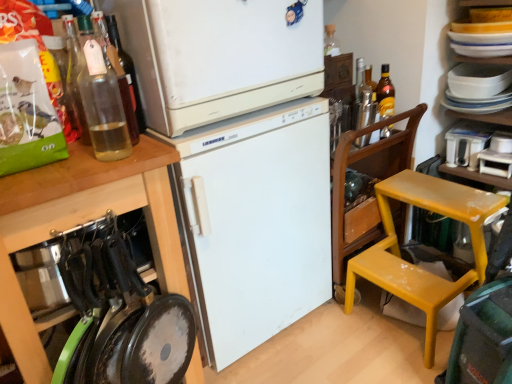
Question: Do you think metallic silver shaker at upper right, the second bottle viewed from the right, is within white glossy bowls at upper right, the 2th appliance ordered from the bottom, or outside of it?

Choices:
 (A) inside
 (B) outside

Answer: (B)

Question: From the image's perspective, is metallic silver shaker at upper right, the 3th bottle viewed from the front, located above or below white glossy bowls at upper right, arranged as the first appliance when viewed from the top?

Choices:
 (A) above
 (B) below

Answer: (B)

Question: Based on their relative distances, which object is farther from the white plastic container at upper right, the first appliance from the bottom?

Choices:
 (A) metallic silver shaker at upper right, positioned as the third bottle in left-to-right order
 (B) white glossy bowls at upper right, the 2th appliance ordered from the bottom
 (C) yellow plastic chair at right
 (D) clear glass bottle at upper left, marked as the 1th bottle in a front-to-back arrangement
 (E) translucent glass bottle at upper right, the 1th bottle from the right

Answer: (D)

Question: Considering the real-world distances, which object is farthest from the yellow plastic chair at right?

Choices:
 (A) translucent glass bottle at upper left, the second bottle from the left
 (B) white glossy bowls at upper right, the 2th appliance ordered from the bottom
 (C) white matte refrigerator at center, which appears as the first refrigerator when ordered from the bottom
 (D) white plastic container at upper right, the first appliance from the bottom
 (E) metallic silver shaker at upper right, arranged as the 2th bottle when viewed from the back

Answer: (A)